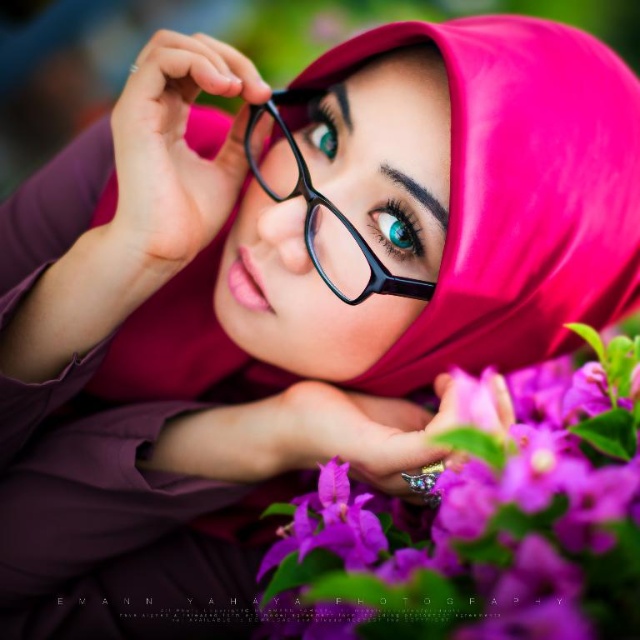
Question: Among these points, which one is nearest to the camera?

Choices:
 (A) (632, 308)
 (B) (330, 122)
 (C) (385, 209)

Answer: (C)

Question: Based on their relative distances, which object is farther from the purple matte flower at center?

Choices:
 (A) teal contact lens at center
 (B) teal glossy eye at center
 (C) pink glossy hijab at center

Answer: (B)

Question: Does pink glossy hijab at center have a smaller size compared to black plastic glasses at center?

Choices:
 (A) yes
 (B) no

Answer: (B)

Question: Which object is positioned closest to the teal contact lens at center?

Choices:
 (A) black plastic glasses at center
 (B) purple matte flower at center

Answer: (A)

Question: In this image, where is pink glossy hijab at center located relative to teal glossy eye at center?

Choices:
 (A) below
 (B) above

Answer: (A)

Question: Is pink glossy hijab at center to the left of teal glossy eye at center from the viewer's perspective?

Choices:
 (A) yes
 (B) no

Answer: (B)